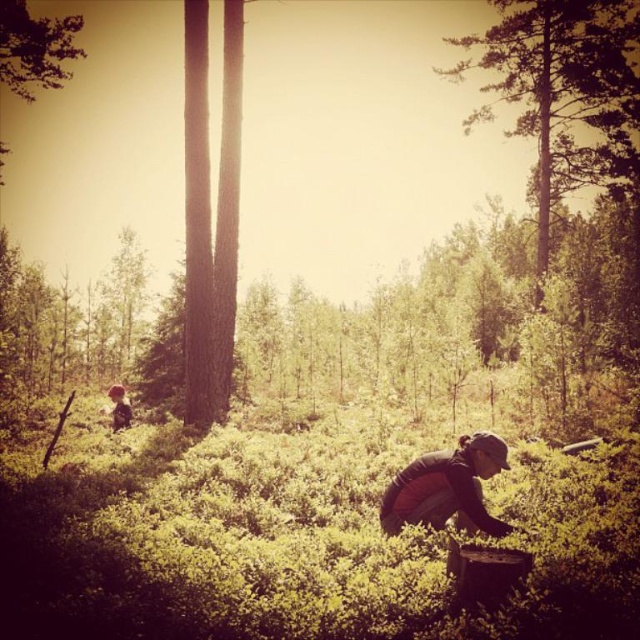
You are a hiker who wants to take a photo of the dark gray fabric at lower center without the green leafy tree at upper right blocking the view. Which direction should you move to ensure the tree is out of frame?

The green leafy tree at upper right is taller than the dark gray fabric at lower center. To avoid the tree blocking the view, move to the left or right so the tree is no longer in the frame.

You are a hiker in the forest and see the dark gray fabric at lower center and the brown fur dog at lower left. Which object is covering the other?

The dark gray fabric at lower center is positioned over brown fur dog at lower left, so the dark gray fabric is covering the brown fur dog.